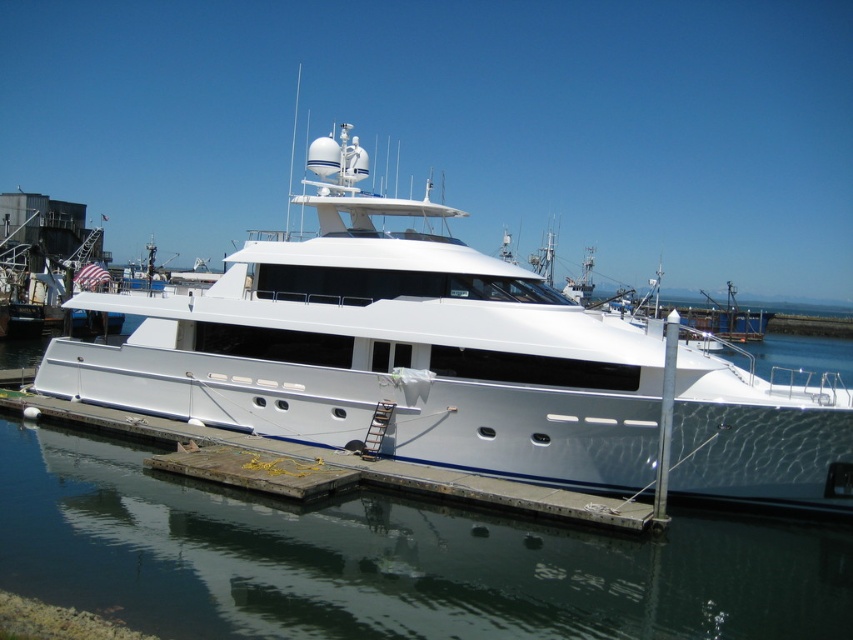
Question: Is white glossy yacht at center to the left of concrete at center from the viewer's perspective?

Choices:
 (A) yes
 (B) no

Answer: (B)

Question: Which object is positioned farthest from the concrete at center?

Choices:
 (A) glossy metallic water at center
 (B) white glossy yacht at center

Answer: (B)

Question: Is white glossy yacht at center to the right of concrete at center from the viewer's perspective?

Choices:
 (A) yes
 (B) no

Answer: (A)

Question: Does glossy metallic water at center have a greater width compared to concrete at center?

Choices:
 (A) no
 (B) yes

Answer: (B)

Question: Which point is farther to the camera?

Choices:
 (A) glossy metallic water at center
 (B) concrete at center
 (C) white glossy yacht at center

Answer: (C)

Question: Which point is farther to the camera?

Choices:
 (A) white glossy yacht at center
 (B) concrete at center

Answer: (A)